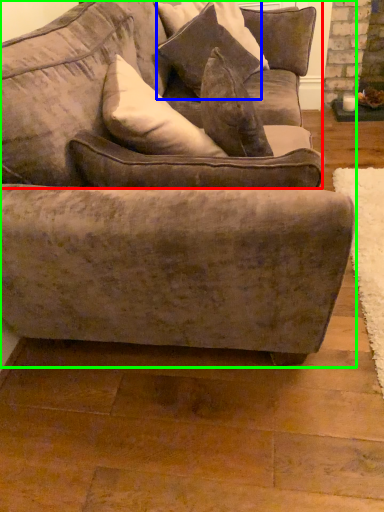
Question: Which is farther away from couch (highlighted by a red box)? pillow (highlighted by a blue box) or studio couch (highlighted by a green box)?

Choices:
 (A) pillow
 (B) studio couch

Answer: (A)